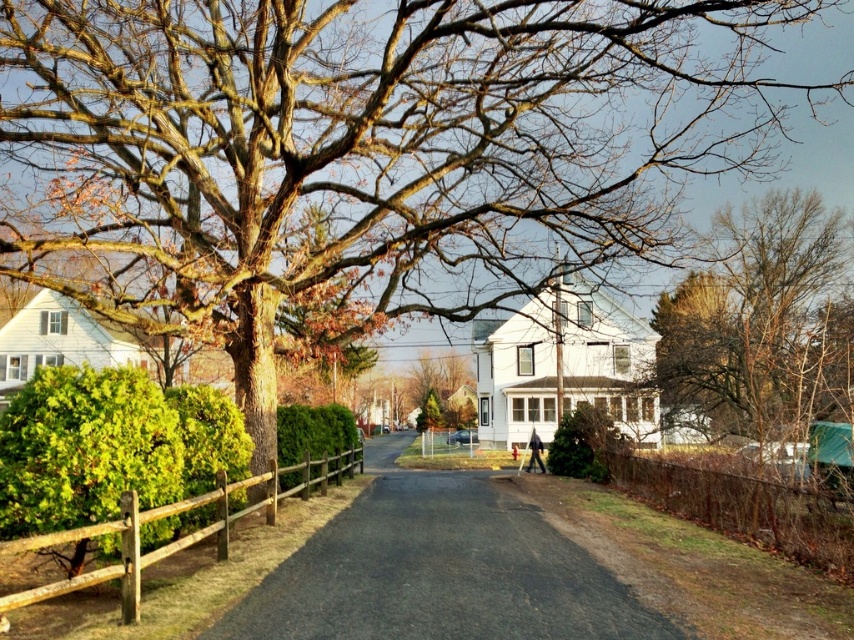
Identify the location of asphalt at center. Image resolution: width=854 pixels, height=640 pixels. (437, 570).

Does asphalt at center appear on the left side of brown wooden fence at right?

Indeed, asphalt at center is positioned on the left side of brown wooden fence at right.

Locate an element on the screen. The width and height of the screenshot is (854, 640). asphalt at center is located at coordinates (437, 570).

The width and height of the screenshot is (854, 640). I want to click on asphalt at center, so click(437, 570).

Does asphalt at center have a smaller size compared to green textured hedge at center?

No, asphalt at center is not smaller than green textured hedge at center.

How much distance is there between asphalt at center and green textured hedge at center?

asphalt at center and green textured hedge at center are 3.77 meters apart from each other.

The image size is (854, 640). I want to click on asphalt at center, so click(437, 570).

Where is `asphalt at center`? This screenshot has height=640, width=854. asphalt at center is located at coordinates (437, 570).

Which is more to the right, green textured hedge at center or green matte hedge at center?

From the viewer's perspective, green matte hedge at center appears more on the right side.

Does point (288, 413) lie behind point (548, 461)?

No, it is in front of (548, 461).

Is point (341, 426) positioned behind point (610, 422)?

No, it is not.

Find the location of `green textured hedge at center`. green textured hedge at center is located at coordinates (313, 432).